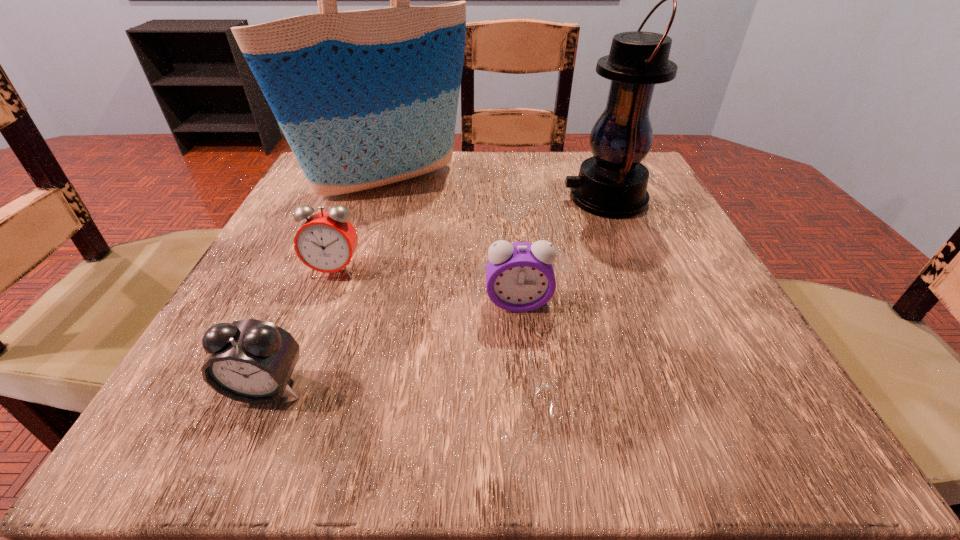
Locate an element on the screen. This screenshot has height=540, width=960. tote bag is located at coordinates (365, 98).

Where is `the rightmost object`? the rightmost object is located at coordinates (613, 183).

The width and height of the screenshot is (960, 540). In order to click on the second tallest object in this screenshot , I will do `click(613, 183)`.

Identify the location of the third farthest object. (326, 242).

Locate an element on the screen. the second nearest object is located at coordinates (520, 277).

In order to click on the rightmost alarm clock in this screenshot , I will do `click(520, 277)`.

Where is `the nearest alarm clock`? This screenshot has width=960, height=540. the nearest alarm clock is located at coordinates (251, 361).

Locate an element on the screen. The width and height of the screenshot is (960, 540). free region located 0.260m on the front of the tote bag is located at coordinates [x=346, y=305].

Locate several points within the vacant space positioned 0.160m above the rightmost object, indicating its light source. Please provide its 2D coordinates. Your answer should be formatted as a tuple, i.e. [(x, y)], where the tuple contains the x and y coordinates of a point satisfying the conditions above.

[(482, 199)]

Identify some points in free space located 0.160m above the rightmost object, indicating its light source. Please provide its 2D coordinates. Your answer should be formatted as a tuple, i.e. [(x, y)], where the tuple contains the x and y coordinates of a point satisfying the conditions above.

[(482, 199)]